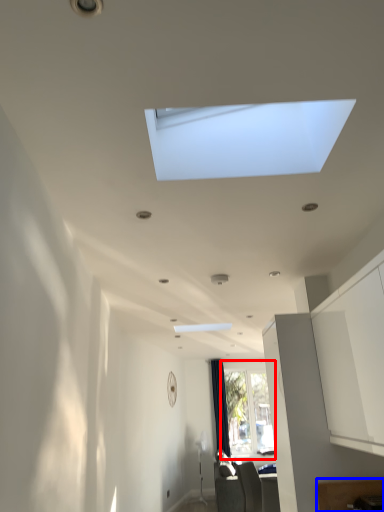
Question: Which point is closer to the camera, window (highlighted by a red box) or furniture (highlighted by a blue box)?

Choices:
 (A) window
 (B) furniture

Answer: (B)